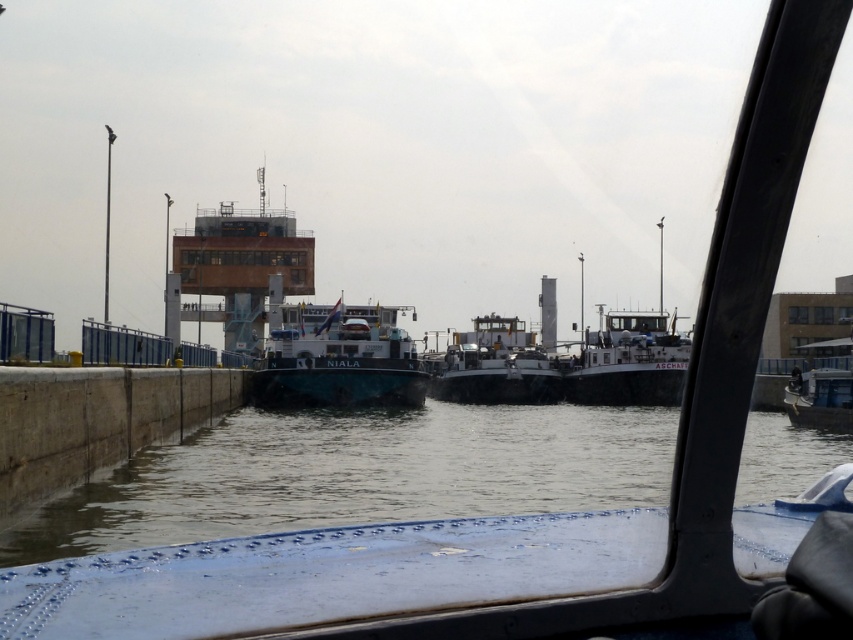
Where is `clear water at center`? This screenshot has height=640, width=853. clear water at center is located at coordinates (358, 474).

Where is `clear water at center`? The height and width of the screenshot is (640, 853). clear water at center is located at coordinates pos(358,474).

Who is more forward, (x=323, y=349) or (x=486, y=392)?

Point (x=323, y=349)

Who is more distant from viewer, (393,344) or (512,364)?

The point (512,364) is behind.

Between point (418, 406) and point (532, 385), which one is positioned in front?

Point (418, 406) is more forward.

This screenshot has width=853, height=640. In order to click on white glossy barge at center in this screenshot , I will do `click(339, 358)`.

Is clear water at center further to the viewer compared to white glossy barge at center?

No, clear water at center is in front of white glossy barge at center.

Which of these two, clear water at center or white glossy barge at center, stands taller?

white glossy barge at center is taller.

Between point (62, 548) and point (297, 317), which one is positioned behind?

Positioned behind is point (297, 317).

The width and height of the screenshot is (853, 640). In order to click on clear water at center in this screenshot , I will do `click(358, 474)`.